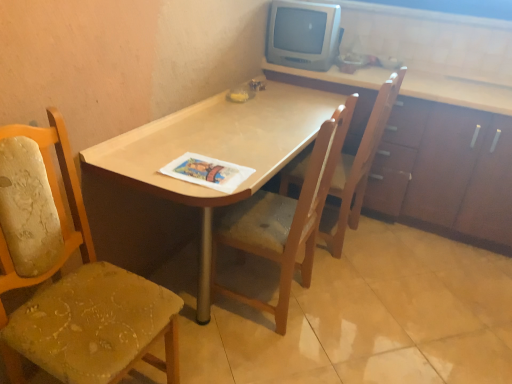
Where is `vacant space to the right of light wood desk at center`? This screenshot has height=384, width=512. vacant space to the right of light wood desk at center is located at coordinates pos(409,296).